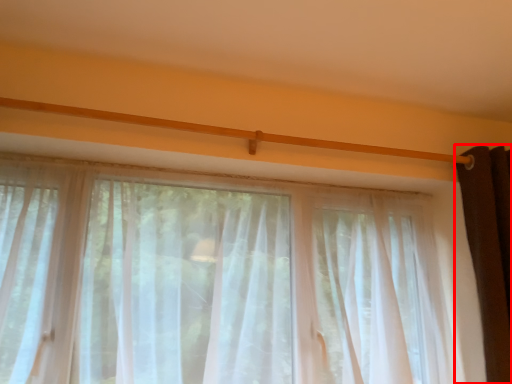
Question: From the image's perspective, considering the relative positions of curtain (annotated by the red box) and curtain in the image provided, where is curtain (annotated by the red box) located with respect to the staircase?

Choices:
 (A) above
 (B) below

Answer: (A)